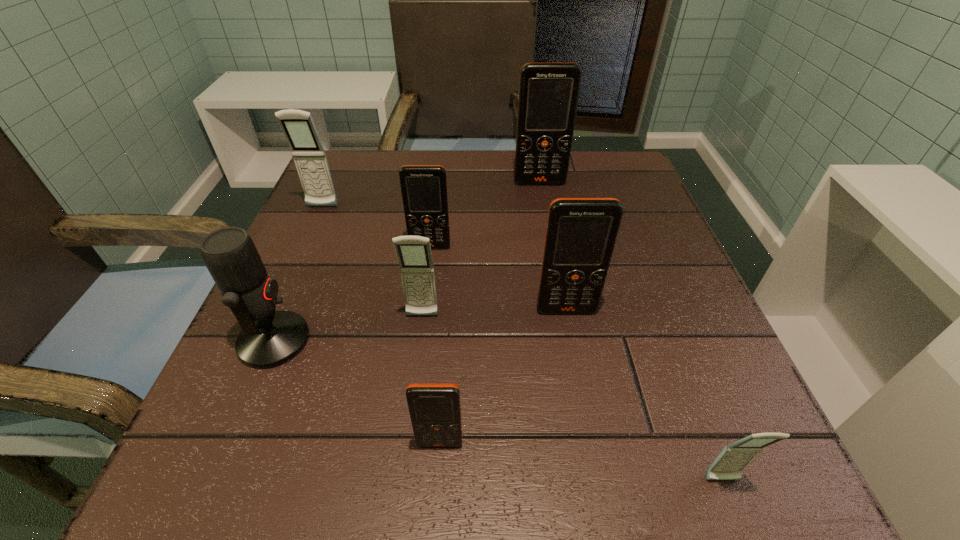
Image resolution: width=960 pixels, height=540 pixels. I want to click on the smallest orange cellular telephone, so click(x=435, y=411).

The image size is (960, 540). Find the location of `the nearest orange cellular telephone`. the nearest orange cellular telephone is located at coordinates (435, 411).

Where is `the rightmost gray cellular telephone`? Image resolution: width=960 pixels, height=540 pixels. the rightmost gray cellular telephone is located at coordinates (728, 465).

Find the location of `the nearest cellular telephone`. the nearest cellular telephone is located at coordinates (728, 465).

The image size is (960, 540). In order to click on vacant space situated on the screen of the biggest orange cellular telephone in this screenshot , I will do `click(552, 254)`.

At what (x,y) coordinates should I click in order to perform the action: click on vacant space positioned 0.130m on the front-facing side of the farthest gray cellular telephone. Please return your answer as a coordinate pair (x, y). Looking at the image, I should click on (303, 251).

What are the coordinates of `free space located 0.150m on the screen of the second nearest orange cellular telephone` in the screenshot? It's located at (583, 395).

Identify the location of free space located 0.280m on the side of the red microphone with the red ring. Image resolution: width=960 pixels, height=540 pixels. (484, 341).

The width and height of the screenshot is (960, 540). I want to click on free location located 0.060m on the front-facing side of the second gray cellular telephone from left to right, so click(x=418, y=351).

Locate an element on the screen. This screenshot has width=960, height=540. free space located on the screen of the third farthest object is located at coordinates (423, 303).